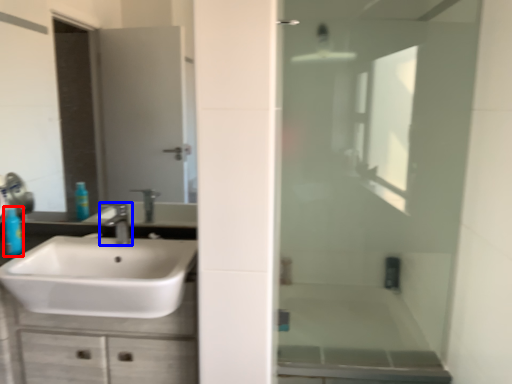
Question: Which of the following is the farthest to the observer, toiletry (highlighted by a red box) or tap (highlighted by a blue box)?

Choices:
 (A) toiletry
 (B) tap

Answer: (A)